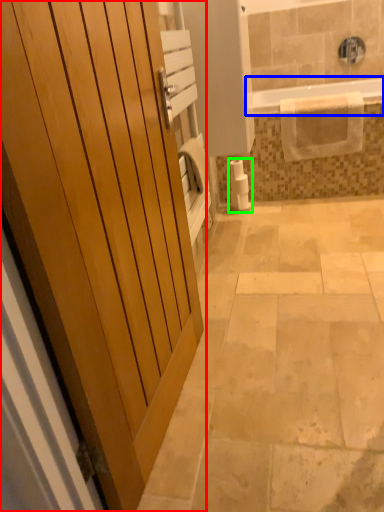
Question: Considering the real-world distances, which object is farthest from door (highlighted by a red box)? bathtub (highlighted by a blue box) or toilet paper (highlighted by a green box)?

Choices:
 (A) bathtub
 (B) toilet paper

Answer: (A)